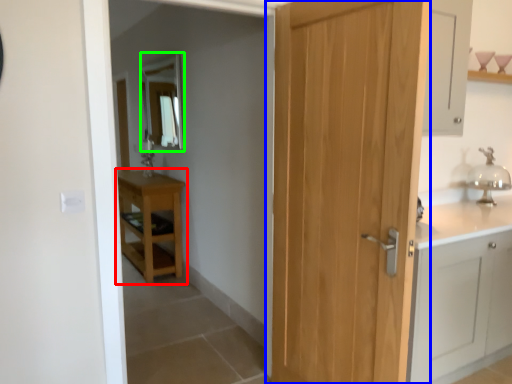
Question: Which is farther away from table (highlighted by a red box)? door (highlighted by a blue box) or mirror (highlighted by a green box)?

Choices:
 (A) door
 (B) mirror

Answer: (A)